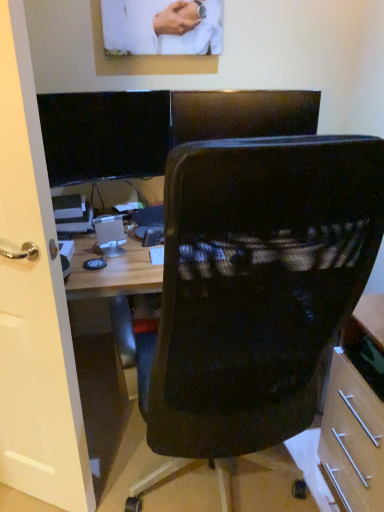
Question: Does white glossy door at left have a lesser height compared to black mesh chair at center?

Choices:
 (A) yes
 (B) no

Answer: (B)

Question: From a real-world perspective, is white glossy door at left positioned under black mesh chair at center based on gravity?

Choices:
 (A) yes
 (B) no

Answer: (B)

Question: From a real-world perspective, is white glossy door at left over black mesh chair at center?

Choices:
 (A) no
 (B) yes

Answer: (B)

Question: Considering the relative positions of white glossy door at left and black mesh chair at center in the image provided, is white glossy door at left to the right of black mesh chair at center from the viewer's perspective?

Choices:
 (A) no
 (B) yes

Answer: (A)

Question: Is white glossy door at left oriented away from black mesh chair at center?

Choices:
 (A) yes
 (B) no

Answer: (B)

Question: Is black mesh chair at center taller or shorter than black glossy monitor at upper left?

Choices:
 (A) tall
 (B) short

Answer: (A)

Question: Is black mesh chair at center inside or outside of black glossy monitor at upper left?

Choices:
 (A) outside
 (B) inside

Answer: (A)

Question: Considering the positions of point (331, 172) and point (59, 179), is point (331, 172) closer or farther from the camera than point (59, 179)?

Choices:
 (A) farther
 (B) closer

Answer: (B)

Question: Considering the relative positions of black mesh chair at center and black glossy monitor at upper left in the image provided, is black mesh chair at center to the left or to the right of black glossy monitor at upper left?

Choices:
 (A) right
 (B) left

Answer: (A)

Question: From the image's perspective, is black glossy monitor at upper left located above or below black mesh chair at center?

Choices:
 (A) below
 (B) above

Answer: (B)

Question: From a real-world perspective, is black glossy monitor at upper left above or below black mesh chair at center?

Choices:
 (A) below
 (B) above

Answer: (B)

Question: Is black glossy monitor at upper left bigger or smaller than black mesh chair at center?

Choices:
 (A) small
 (B) big

Answer: (A)

Question: Would you say black glossy monitor at upper left is to the left or to the right of black mesh chair at center in the picture?

Choices:
 (A) right
 (B) left

Answer: (B)

Question: Choose the correct answer: Is white glossy door at left inside black glossy monitor at upper left or outside it?

Choices:
 (A) outside
 (B) inside

Answer: (A)

Question: Is white glossy door at left taller or shorter than black glossy monitor at upper left?

Choices:
 (A) tall
 (B) short

Answer: (A)